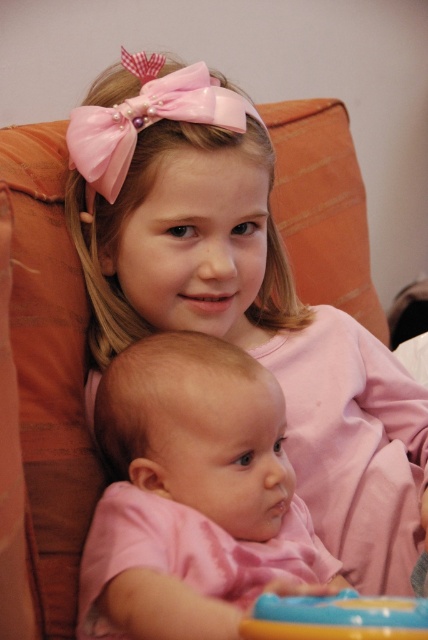
Question: In this image, where is pink glossy bow at upper center located relative to smooth plastic toy at lower center?

Choices:
 (A) below
 (B) above

Answer: (B)

Question: Which object is closer to the camera taking this photo?

Choices:
 (A) pink glossy bow at upper center
 (B) pink satin baby at center
 (C) smooth plastic toy at lower center

Answer: (C)

Question: Does pink glossy bow at upper center appear under smooth plastic toy at lower center?

Choices:
 (A) no
 (B) yes

Answer: (A)

Question: Which point is closer to the camera taking this photo?

Choices:
 (A) (237, 96)
 (B) (291, 550)

Answer: (B)

Question: Is the position of pink glossy bow at upper center less distant than that of smooth plastic toy at lower center?

Choices:
 (A) yes
 (B) no

Answer: (B)

Question: Which is nearer to the smooth plastic toy at lower center?

Choices:
 (A) pink glossy bow at upper center
 (B) pink satin baby at center

Answer: (B)